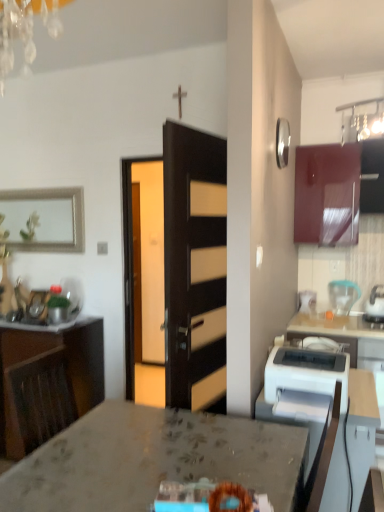
At what (x,y) coordinates should I click in order to perform the action: click on vacant point above silver metallic picture frame at upper left (from a real-world perspective). Please return your answer as a coordinate pair (x, y). The height and width of the screenshot is (512, 384). Looking at the image, I should click on (38, 187).